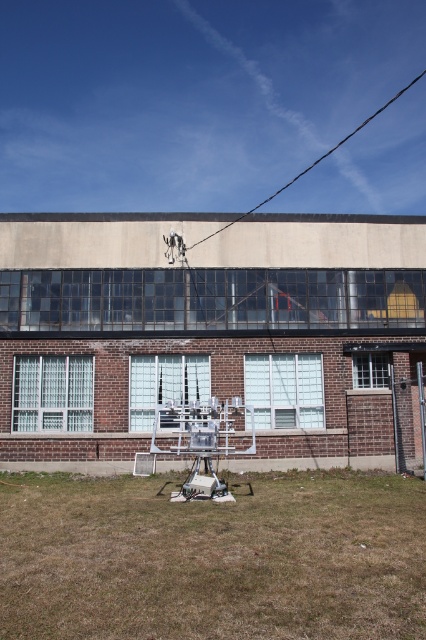
Is brown dry grass at lower center shorter than black wire at upper center?

Yes, brown dry grass at lower center is shorter than black wire at upper center.

Is brown dry grass at lower center to the right of black wire at upper center from the viewer's perspective?

In fact, brown dry grass at lower center is to the left of black wire at upper center.

Is point (40, 484) in front of point (313, 163)?

That is True.

Locate an element on the screen. brown dry grass at lower center is located at coordinates (213, 557).